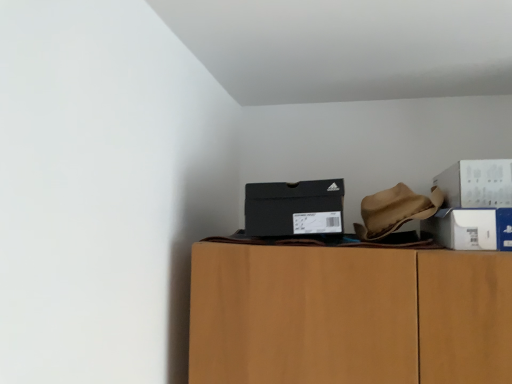
The width and height of the screenshot is (512, 384). In order to click on black matte shoebox at upper center, the 3th box from the right in this screenshot , I will do `click(294, 208)`.

What do you see at coordinates (470, 228) in the screenshot? I see `white cardboard box at right, which ranks as the 2th box in right-to-left order` at bounding box center [470, 228].

What do you see at coordinates (477, 183) in the screenshot? I see `white cardboard box at upper right, which is the first box from right to left` at bounding box center [477, 183].

The height and width of the screenshot is (384, 512). Find the location of `black matte shoebox at upper center, which is counted as the 1th box, starting from the left`. black matte shoebox at upper center, which is counted as the 1th box, starting from the left is located at coordinates (294, 208).

Can you confirm if black matte shoebox at upper center, the 3th box from the right, is smaller than white cardboard box at upper right, which is the first box from right to left?

Yes, black matte shoebox at upper center, the 3th box from the right, is smaller than white cardboard box at upper right, which is the first box from right to left.

Based on the photo, how far apart are black matte shoebox at upper center, which is counted as the 1th box, starting from the left, and white cardboard box at upper right, the third box in the left-to-right sequence?

black matte shoebox at upper center, which is counted as the 1th box, starting from the left, is 14.74 inches from white cardboard box at upper right, the third box in the left-to-right sequence.

From a real-world perspective, is black matte shoebox at upper center, which is counted as the 1th box, starting from the left, above or below white cardboard box at upper right, which is the first box from right to left?

black matte shoebox at upper center, which is counted as the 1th box, starting from the left, is situated lower than white cardboard box at upper right, which is the first box from right to left, in the real world.

From the image's perspective, which object appears higher, black matte shoebox at upper center, the 3th box from the right, or white cardboard box at upper right, which is the first box from right to left?

From the image's view, white cardboard box at upper right, which is the first box from right to left, is above.

Which of these two, white cardboard box at right, which ranks as the 2th box in right-to-left order, or black matte shoebox at upper center, the 3th box from the right, stands shorter?

With less height is white cardboard box at right, which ranks as the 2th box in right-to-left order.

From a real-world perspective, relative to black matte shoebox at upper center, the 3th box from the right, is white cardboard box at right, which ranks as the 2th box in right-to-left order, vertically above or below?

white cardboard box at right, which ranks as the 2th box in right-to-left order, is situated lower than black matte shoebox at upper center, the 3th box from the right, in the real world.

Considering the relative positions of white cardboard box at right, which ranks as the 2th box in right-to-left order, and black matte shoebox at upper center, which is counted as the 1th box, starting from the left, in the image provided, is white cardboard box at right, which ranks as the 2th box in right-to-left order, to the left of black matte shoebox at upper center, which is counted as the 1th box, starting from the left, from the viewer's perspective?

No.

Between white cardboard box at right, which ranks as the 2th box in right-to-left order, and black matte shoebox at upper center, which is counted as the 1th box, starting from the left, which one is positioned behind?

black matte shoebox at upper center, which is counted as the 1th box, starting from the left, is further from the camera.

Based on the photo, considering the sizes of white cardboard box at upper right, the third box in the left-to-right sequence, and black matte shoebox at upper center, the 3th box from the right, in the image, is white cardboard box at upper right, the third box in the left-to-right sequence, bigger or smaller than black matte shoebox at upper center, the 3th box from the right,?

In the image, white cardboard box at upper right, the third box in the left-to-right sequence, appears to be larger than black matte shoebox at upper center, the 3th box from the right.

Does point (460, 182) appear closer or farther from the camera than point (316, 213)?

Point (460, 182) appears to be farther away from the viewer than point (316, 213).

Is white cardboard box at upper right, which is the first box from right to left, shorter than black matte shoebox at upper center, the 3th box from the right?

Correct, white cardboard box at upper right, which is the first box from right to left, is not as tall as black matte shoebox at upper center, the 3th box from the right.

From the image's perspective, relative to white cardboard box at upper right, which is the first box from right to left, is white cardboard box at right, which ranks as the 2th box in right-to-left order, above or below?

Based on their image positions, white cardboard box at right, which ranks as the 2th box in right-to-left order, is located beneath white cardboard box at upper right, which is the first box from right to left.

Is the position of white cardboard box at right, which ranks as the 2th box in right-to-left order, less distant than that of white cardboard box at upper right, the third box in the left-to-right sequence?

That is False.

Would you say white cardboard box at right, which is the second box from left to right, is to the left or to the right of white cardboard box at upper right, which is the first box from right to left, in the picture?

white cardboard box at right, which is the second box from left to right, is to the left of white cardboard box at upper right, which is the first box from right to left.

Is white cardboard box at upper right, the third box in the left-to-right sequence, with white cardboard box at right, which is the second box from left to right?

Yes.

From the image's perspective, is white cardboard box at upper right, the third box in the left-to-right sequence, over white cardboard box at right, which is the second box from left to right?

Correct, white cardboard box at upper right, the third box in the left-to-right sequence, appears higher than white cardboard box at right, which is the second box from left to right, in the image.

Considering the relative positions of black matte shoebox at upper center, the 3th box from the right, and white cardboard box at right, which is the second box from left to right, in the image provided, is black matte shoebox at upper center, the 3th box from the right, to the left or to the right of white cardboard box at right, which is the second box from left to right,?

black matte shoebox at upper center, the 3th box from the right, is to the left of white cardboard box at right, which is the second box from left to right.

From a real-world perspective, is black matte shoebox at upper center, the 3th box from the right, positioned above or below white cardboard box at right, which is the second box from left to right?

black matte shoebox at upper center, the 3th box from the right, is above white cardboard box at right, which is the second box from left to right.

In terms of width, does black matte shoebox at upper center, which is counted as the 1th box, starting from the left, look wider or thinner when compared to white cardboard box at right, which is the second box from left to right?

Considering their sizes, black matte shoebox at upper center, which is counted as the 1th box, starting from the left, looks slimmer than white cardboard box at right, which is the second box from left to right.

Locate an element on the screen. Image resolution: width=512 pixels, height=384 pixels. the 2nd box to the right when counting from the black matte shoebox at upper center, the 3th box from the right is located at coordinates (477, 183).

The height and width of the screenshot is (384, 512). I want to click on box that is under the black matte shoebox at upper center, which is counted as the 1th box, starting from the left (from a real-world perspective), so click(x=470, y=228).

Which object lies nearer to the anchor point black matte shoebox at upper center, which is counted as the 1th box, starting from the left, white cardboard box at right, which ranks as the 2th box in right-to-left order, or white cardboard box at upper right, which is the first box from right to left?

white cardboard box at right, which ranks as the 2th box in right-to-left order, lies closer to black matte shoebox at upper center, which is counted as the 1th box, starting from the left, than the other object.

From the image, which object appears to be nearer to white cardboard box at right, which ranks as the 2th box in right-to-left order, white cardboard box at upper right, the third box in the left-to-right sequence, or black matte shoebox at upper center, which is counted as the 1th box, starting from the left?

white cardboard box at upper right, the third box in the left-to-right sequence.

Considering their positions, is black matte shoebox at upper center, the 3th box from the right, positioned further to white cardboard box at upper right, which is the first box from right to left, than white cardboard box at right, which is the second box from left to right?

black matte shoebox at upper center, the 3th box from the right, lies further to white cardboard box at upper right, which is the first box from right to left, than the other object.

When comparing their distances from white cardboard box at right, which is the second box from left to right, does black matte shoebox at upper center, the 3th box from the right, or white cardboard box at upper right, which is the first box from right to left, seem further?

Among the two, black matte shoebox at upper center, the 3th box from the right, is located further to white cardboard box at right, which is the second box from left to right.

Consider the image. When comparing their distances from black matte shoebox at upper center, which is counted as the 1th box, starting from the left, does white cardboard box at upper right, which is the first box from right to left, or white cardboard box at right, which is the second box from left to right, seem further?

white cardboard box at upper right, which is the first box from right to left, is positioned further to the anchor black matte shoebox at upper center, which is counted as the 1th box, starting from the left.

Based on the photo, estimate the real-world distances between objects in this image. Which object is closer to white cardboard box at upper right, which is the first box from right to left, white cardboard box at right, which ranks as the 2th box in right-to-left order, or black matte shoebox at upper center, the 3th box from the right?

white cardboard box at right, which ranks as the 2th box in right-to-left order, lies closer to white cardboard box at upper right, which is the first box from right to left, than the other object.

At what (x,y) coordinates should I click in order to perform the action: click on box between black matte shoebox at upper center, the 3th box from the right, and white cardboard box at upper right, which is the first box from right to left, from left to right. Please return your answer as a coordinate pair (x, y). Looking at the image, I should click on (470, 228).